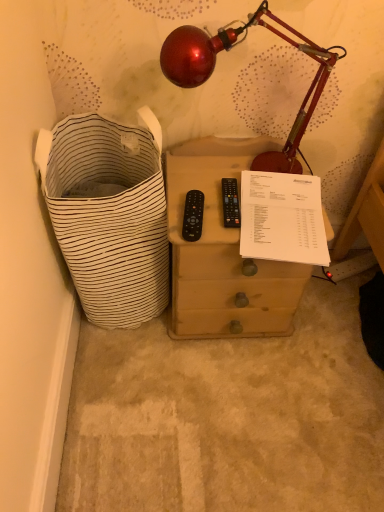
The image size is (384, 512). Find the location of `metallic red lamp at upper center`. metallic red lamp at upper center is located at coordinates point(230,48).

Find the location of `black plastic remote at center, the second control when ordered from left to right`. black plastic remote at center, the second control when ordered from left to right is located at coordinates (231, 203).

Find the location of a particular element. black plastic remote at center, the 2th control positioned from the right is located at coordinates (193, 216).

Considering the relative positions of white striped fabric laundry basket at left and metallic red lamp at upper center in the image provided, is white striped fabric laundry basket at left in front of metallic red lamp at upper center?

No, it is behind metallic red lamp at upper center.

Is white striped fabric laundry basket at left thinner than metallic red lamp at upper center?

In fact, white striped fabric laundry basket at left might be wider than metallic red lamp at upper center.

Does white striped fabric laundry basket at left have a smaller size compared to metallic red lamp at upper center?

No.

From a real-world perspective, is white paper at upper right physically below black plastic remote at center, the second control when ordered from left to right?

Yes, from a real-world perspective, white paper at upper right is under black plastic remote at center, the second control when ordered from left to right.

How different are the orientations of white paper at upper right and black plastic remote at center, the second control when ordered from left to right, in degrees?

The facing directions of white paper at upper right and black plastic remote at center, the second control when ordered from left to right, are 5.81 degrees apart.

Locate an element on the screen. This screenshot has height=512, width=384. writing on the right of black plastic remote at center, which ranks as the first control in right-to-left order is located at coordinates point(282,218).

Is there a large distance between white paper at upper right and black plastic remote at center, the second control when ordered from left to right?

Actually, white paper at upper right and black plastic remote at center, the second control when ordered from left to right, are a little close together.

From the image's perspective, is black plastic remote at center, the second control when ordered from left to right, above white striped fabric laundry basket at left?

Yes, from the image's perspective, black plastic remote at center, the second control when ordered from left to right, is over white striped fabric laundry basket at left.

Considering the sizes of objects black plastic remote at center, the second control when ordered from left to right, and white striped fabric laundry basket at left in the image provided, who is wider, black plastic remote at center, the second control when ordered from left to right, or white striped fabric laundry basket at left?

white striped fabric laundry basket at left is wider.

Does point (228, 189) come behind point (88, 121)?

No, it is in front of (88, 121).

What's the angular difference between black plastic remote at center, which ranks as the first control in right-to-left order, and white striped fabric laundry basket at left's facing directions?

3.91 degrees.

Is white striped fabric laundry basket at left positioned beyond the bounds of wooden nightstand at center?

Yes, white striped fabric laundry basket at left is located beyond the bounds of wooden nightstand at center.

Consider the image. Between white striped fabric laundry basket at left and wooden nightstand at center, which one has less height?

wooden nightstand at center.

Considering the relative positions of white striped fabric laundry basket at left and wooden nightstand at center in the image provided, is white striped fabric laundry basket at left to the right of wooden nightstand at center from the viewer's perspective?

In fact, white striped fabric laundry basket at left is to the left of wooden nightstand at center.

Does white striped fabric laundry basket at left turn towards wooden nightstand at center?

No, white striped fabric laundry basket at left is not aimed at wooden nightstand at center.

How different are the orientations of black plastic remote at center, the 1th control viewed from the left, and black plastic remote at center, which ranks as the first control in right-to-left order, in degrees?

The angular difference between black plastic remote at center, the 1th control viewed from the left, and black plastic remote at center, which ranks as the first control in right-to-left order, is 3.3 degrees.

Based on their positions, is black plastic remote at center, the 2th control positioned from the right, located to the left or right of black plastic remote at center, which ranks as the first control in right-to-left order?

In the image, black plastic remote at center, the 2th control positioned from the right, appears on the left side of black plastic remote at center, which ranks as the first control in right-to-left order.

Which of these two, black plastic remote at center, the 1th control viewed from the left, or black plastic remote at center, which ranks as the first control in right-to-left order, is thinner?

black plastic remote at center, the 1th control viewed from the left, is thinner.

From a real-world perspective, is black plastic remote at center, the 2th control positioned from the right, positioned above or below black plastic remote at center, the second control when ordered from left to right?

Clearly, from a real-world perspective, black plastic remote at center, the 2th control positioned from the right, is above black plastic remote at center, the second control when ordered from left to right.

How distant is wooden nightstand at center from black plastic remote at center, the second control when ordered from left to right?

wooden nightstand at center is 8.38 inches away from black plastic remote at center, the second control when ordered from left to right.

Considering the sizes of objects wooden nightstand at center and black plastic remote at center, the second control when ordered from left to right, in the image provided, who is shorter, wooden nightstand at center or black plastic remote at center, the second control when ordered from left to right,?

With less height is black plastic remote at center, the second control when ordered from left to right.

From the image's perspective, which is above, wooden nightstand at center or black plastic remote at center, which ranks as the first control in right-to-left order?

black plastic remote at center, which ranks as the first control in right-to-left order.

From the image's perspective, count 2nd controls upward from the wooden nightstand at center and point to it. Please provide its 2D coordinates.

[(231, 203)]

Based on the photo, considering the sizes of black plastic remote at center, the 2th control positioned from the right, and wooden nightstand at center in the image, is black plastic remote at center, the 2th control positioned from the right, wider or thinner than wooden nightstand at center?

Considering their sizes, black plastic remote at center, the 2th control positioned from the right, looks slimmer than wooden nightstand at center.

Does black plastic remote at center, the 2th control positioned from the right, appear on the right side of wooden nightstand at center?

No, black plastic remote at center, the 2th control positioned from the right, is not to the right of wooden nightstand at center.

At what (x,y) coordinates should I click in order to perform the action: click on laundry basket lying below the metallic red lamp at upper center (from the image's perspective). Please return your answer as a coordinate pair (x, y). This screenshot has height=512, width=384. Looking at the image, I should click on (109, 214).

Where is `the 1st control counting from the left of the white paper at upper right`? The width and height of the screenshot is (384, 512). the 1st control counting from the left of the white paper at upper right is located at coordinates (231, 203).

Considering their positions, is white striped fabric laundry basket at left positioned closer to black plastic remote at center, the second control when ordered from left to right, than black plastic remote at center, the 1th control viewed from the left?

Among the two, black plastic remote at center, the 1th control viewed from the left, is located nearer to black plastic remote at center, the second control when ordered from left to right.

Which object lies nearer to the anchor point black plastic remote at center, the 1th control viewed from the left, black plastic remote at center, which ranks as the first control in right-to-left order, or white striped fabric laundry basket at left?

Among the two, black plastic remote at center, which ranks as the first control in right-to-left order, is located nearer to black plastic remote at center, the 1th control viewed from the left.

When comparing their distances from white paper at upper right, does black plastic remote at center, the 1th control viewed from the left, or white striped fabric laundry basket at left seem closer?

The object closer to white paper at upper right is black plastic remote at center, the 1th control viewed from the left.

Based on their spatial positions, is white paper at upper right or wooden nightstand at center closer to black plastic remote at center, the 1th control viewed from the left?

The object closer to black plastic remote at center, the 1th control viewed from the left, is white paper at upper right.

Based on their spatial positions, is black plastic remote at center, which ranks as the first control in right-to-left order, or white striped fabric laundry basket at left closer to white paper at upper right?

Based on the image, black plastic remote at center, which ranks as the first control in right-to-left order, appears to be nearer to white paper at upper right.

Which object lies further to the anchor point white striped fabric laundry basket at left, metallic red lamp at upper center or wooden nightstand at center?

Among the two, metallic red lamp at upper center is located further to white striped fabric laundry basket at left.

Estimate the real-world distances between objects in this image. Which object is further from wooden nightstand at center, black plastic remote at center, which ranks as the first control in right-to-left order, or white paper at upper right?

black plastic remote at center, which ranks as the first control in right-to-left order, is positioned further to the anchor wooden nightstand at center.

From the image, which object appears to be nearer to black plastic remote at center, the second control when ordered from left to right, wooden nightstand at center or black plastic remote at center, the 1th control viewed from the left?

black plastic remote at center, the 1th control viewed from the left.

Locate an element on the screen. The image size is (384, 512). control between black plastic remote at center, the 2th control positioned from the right, and wooden nightstand at center is located at coordinates (231, 203).

Find the location of a particular element. The image size is (384, 512). control located between white striped fabric laundry basket at left and black plastic remote at center, the second control when ordered from left to right, in the left-right direction is located at coordinates (193, 216).

Identify the location of nightstand between white striped fabric laundry basket at left and white paper at upper right from left to right. (223, 251).

Locate an element on the screen. The image size is (384, 512). nightstand between black plastic remote at center, which ranks as the first control in right-to-left order, and white paper at upper right, in the horizontal direction is located at coordinates (223, 251).